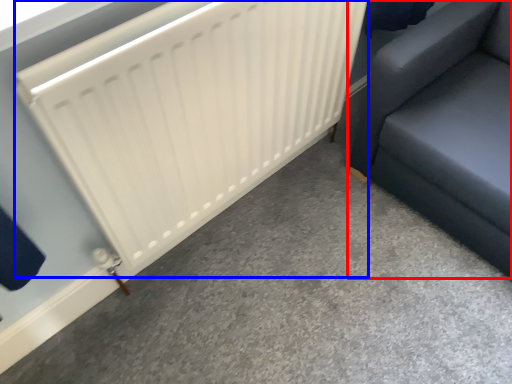
Question: Which of the following is the farthest to the observer, furniture (highlighted by a red box) or radiator (highlighted by a blue box)?

Choices:
 (A) furniture
 (B) radiator

Answer: (A)